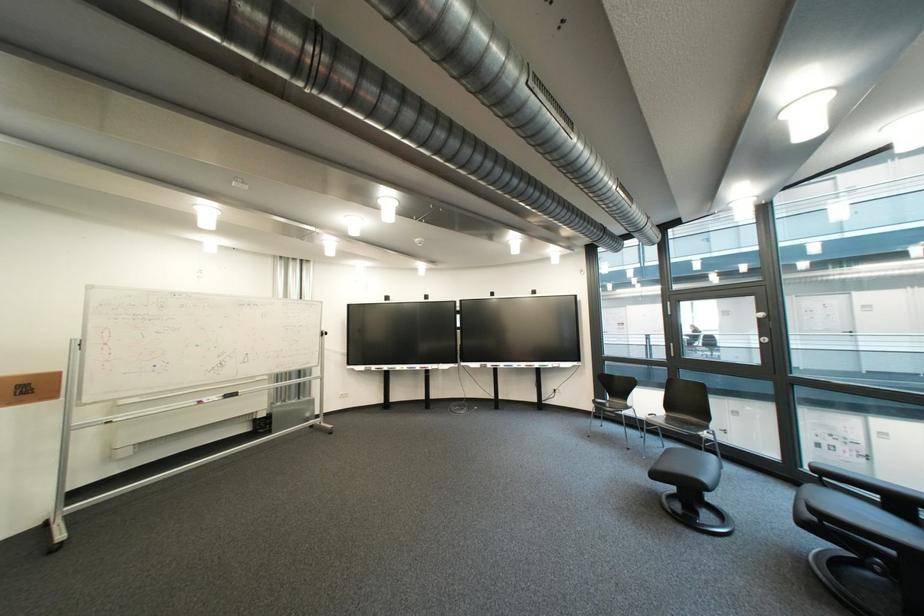
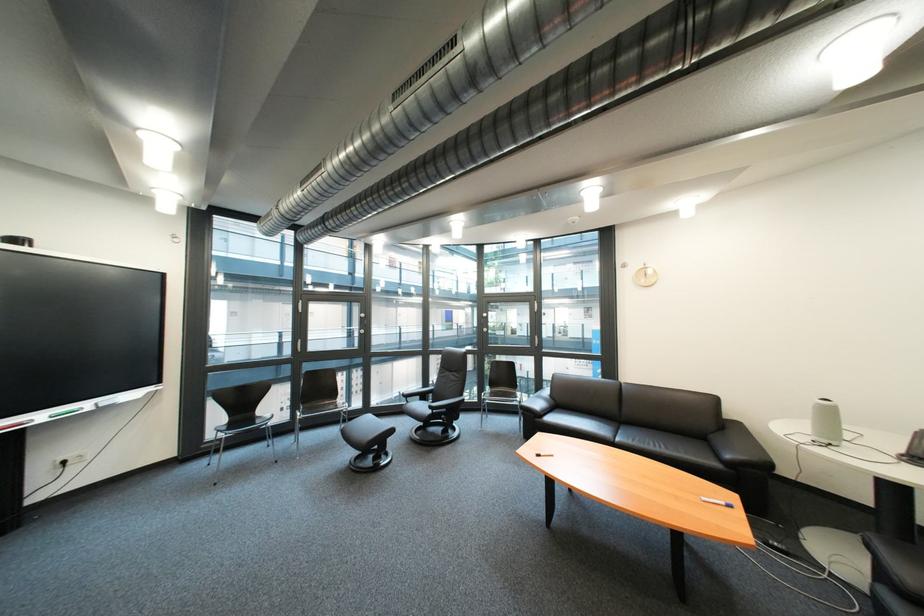
Where in the second image is the point corresponding to pixel 564 366 from the first image?

(101, 406)